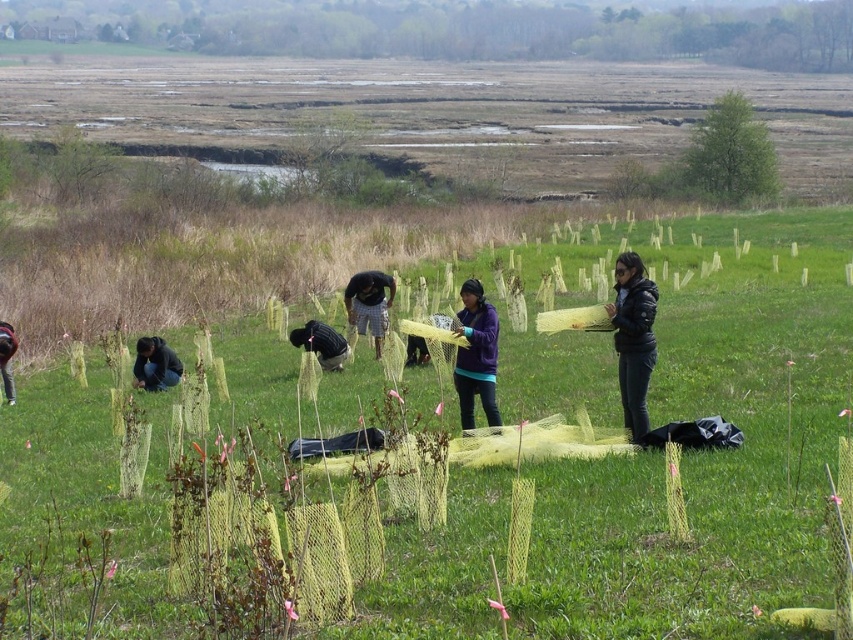
You are planning to set up a small picnic area in the green grassy at center and want to place a picnic blanket. Considering the green leafy tree at upper right is nearby, will the tree provide enough shade over the picnic blanket? Please explain based on their sizes.

The green grassy at center is wider than the green leafy tree at upper right. Since the tree is narrower than the grassy area, its shade might not fully cover the entire picnic blanket placed in the wider grassy area.

You are a drone operator who needs to capture a closeup shot of the dark blue jacket at center and the dark gray pants at lower left simultaneously. What is the minimum distance the drone should be from the ground to ensure both objects are in frame?

The dark blue jacket at center and dark gray pants at lower left are 4.62 meters apart from each other. To capture both in frame, the drone should be positioned at least 4.62 meters away from the ground.